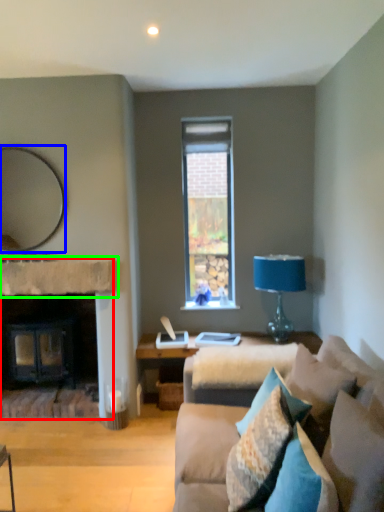
Question: Estimate the real-world distances between objects in this image. Which object is farther from fireplace (highlighted by a red box), mirror (highlighted by a blue box) or mantle (highlighted by a green box)?

Choices:
 (A) mirror
 (B) mantle

Answer: (A)